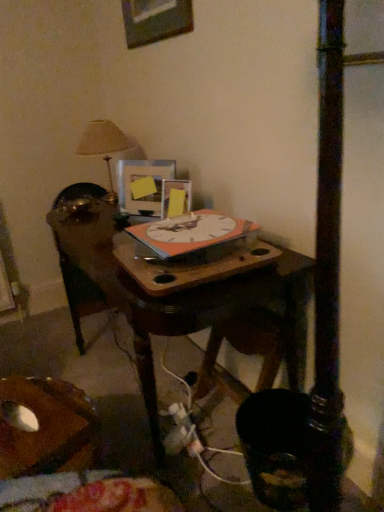
Question: From a real-world perspective, is white plastic plug at lower center on matte plastic picture frame at center, the 2th picture frame in the top-to-bottom sequence?

Choices:
 (A) yes
 (B) no

Answer: (B)

Question: Is white plastic plug at lower center wider than matte plastic picture frame at center, which is the second picture frame from bottom to top?

Choices:
 (A) no
 (B) yes

Answer: (B)

Question: From the image's perspective, would you say white plastic plug at lower center is shown under matte plastic picture frame at center, the 2th picture frame in the top-to-bottom sequence?

Choices:
 (A) no
 (B) yes

Answer: (B)

Question: Is white plastic plug at lower center to the right of matte plastic picture frame at center, the 2th picture frame in the top-to-bottom sequence, from the viewer's perspective?

Choices:
 (A) yes
 (B) no

Answer: (A)

Question: Is white plastic plug at lower center outside matte plastic picture frame at center, the 2th picture frame in the top-to-bottom sequence?

Choices:
 (A) yes
 (B) no

Answer: (A)

Question: In the image, is matte plastic picture frame at center, which is the second picture frame from bottom to top, on the left side or the right side of matte plastic picture frame at center, which is counted as the first picture frame, starting from the bottom?

Choices:
 (A) right
 (B) left

Answer: (B)

Question: Do you think matte plastic picture frame at center, which is the second picture frame from bottom to top, is within matte plastic picture frame at center, marked as the 3th picture frame in a top-to-bottom arrangement, or outside of it?

Choices:
 (A) inside
 (B) outside

Answer: (B)

Question: Considering the positions of matte plastic picture frame at center, the 2th picture frame in the top-to-bottom sequence, and matte plastic picture frame at center, marked as the 3th picture frame in a top-to-bottom arrangement, in the image, is matte plastic picture frame at center, the 2th picture frame in the top-to-bottom sequence, taller or shorter than matte plastic picture frame at center, marked as the 3th picture frame in a top-to-bottom arrangement,?

Choices:
 (A) short
 (B) tall

Answer: (B)

Question: Looking at their shapes, would you say matte plastic picture frame at center, which is the second picture frame from bottom to top, is wider or thinner than matte plastic picture frame at center, which is counted as the first picture frame, starting from the bottom?

Choices:
 (A) wide
 (B) thin

Answer: (B)

Question: Considering the relative positions of wooden picture frame at upper center, positioned as the third picture frame in bottom-to-top order, and white plastic plug at lower center in the image provided, is wooden picture frame at upper center, positioned as the third picture frame in bottom-to-top order, to the left or to the right of white plastic plug at lower center?

Choices:
 (A) right
 (B) left

Answer: (B)

Question: Is wooden picture frame at upper center, positioned as the third picture frame in bottom-to-top order, in front of or behind white plastic plug at lower center in the image?

Choices:
 (A) behind
 (B) front

Answer: (A)

Question: Is point (135, 10) positioned closer to the camera than point (198, 448)?

Choices:
 (A) closer
 (B) farther

Answer: (B)

Question: From the image's perspective, is wooden picture frame at upper center, positioned as the third picture frame in bottom-to-top order, above or below white plastic plug at lower center?

Choices:
 (A) above
 (B) below

Answer: (A)

Question: Considering the positions of orange matte clock at center and matte plastic picture frame at center, which is the second picture frame from bottom to top, in the image, is orange matte clock at center taller or shorter than matte plastic picture frame at center, which is the second picture frame from bottom to top,?

Choices:
 (A) tall
 (B) short

Answer: (B)

Question: Do you think orange matte clock at center is within matte plastic picture frame at center, which is the second picture frame from bottom to top, or outside of it?

Choices:
 (A) outside
 (B) inside

Answer: (A)